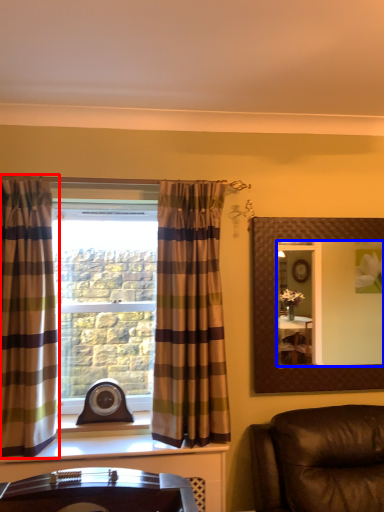
Question: Which point is further to the camera, curtain (highlighted by a red box) or mirror (highlighted by a blue box)?

Choices:
 (A) curtain
 (B) mirror

Answer: (B)